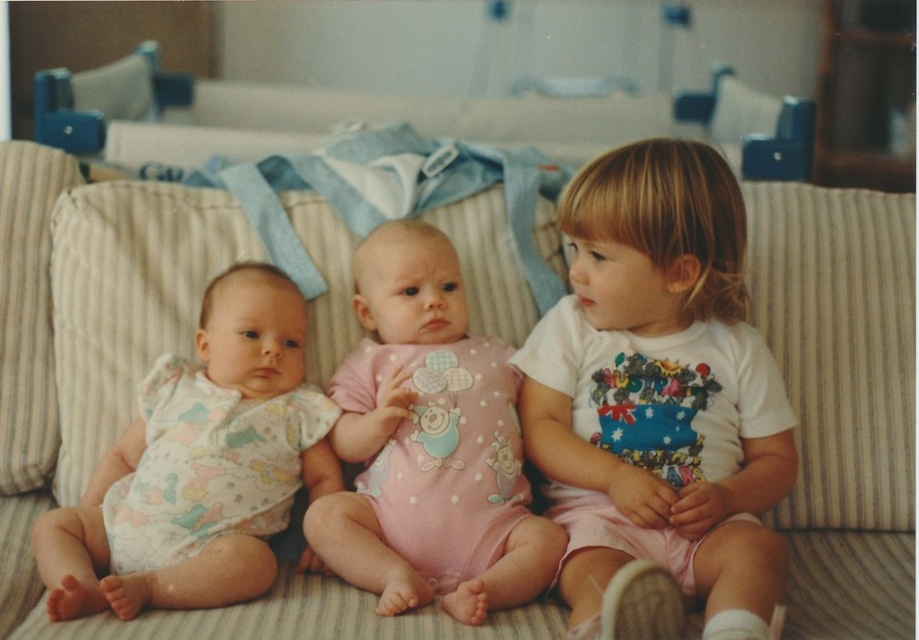
You are a parent trying to decide whether to place a small toy between the white cotton shirt at center and the blue fabric playpen at upper center. Based on their sizes, which object should you place the toy closer to?

The white cotton shirt at center is larger than the blue fabric playpen at upper center, so you should place the toy closer to the white cotton shirt at center to ensure it is visible and accessible.

Based on the photo, you are a parent trying to place a white cotton shirt at center on a hanger that is 3 feet away from the blue fabric playpen at upper center. Can you determine if the shirt will reach the hanger without moving the playpen?

The distance between the white cotton shirt at center and the blue fabric playpen at upper center is 3.54 feet. Since the hanger is only 3 feet away from the playpen, the shirt can reach the hanger without moving the playpen.